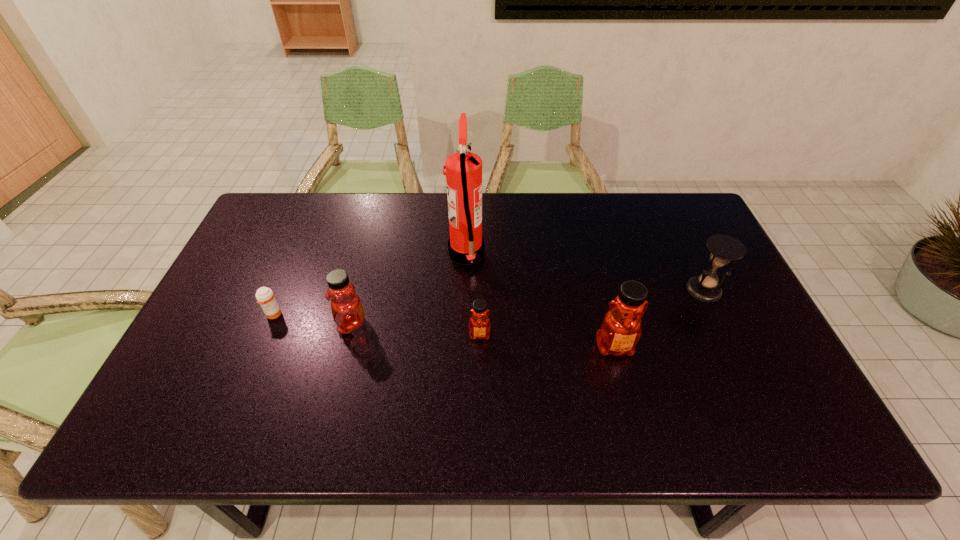
Locate an element on the screen. the second object from left to right is located at coordinates (346, 306).

The width and height of the screenshot is (960, 540). Find the location of `the leftmost honey`. the leftmost honey is located at coordinates (346, 306).

The width and height of the screenshot is (960, 540). In order to click on the second honey from right to left in this screenshot , I will do `click(479, 324)`.

This screenshot has height=540, width=960. Identify the location of the shortest honey. (479, 324).

Where is `the fifth object from left to right`? This screenshot has height=540, width=960. the fifth object from left to right is located at coordinates (621, 329).

This screenshot has height=540, width=960. What are the coordinates of `the tallest object` in the screenshot? It's located at (463, 173).

Where is `the rightmost object`? This screenshot has height=540, width=960. the rightmost object is located at coordinates (724, 248).

Where is `the shortest object`? This screenshot has height=540, width=960. the shortest object is located at coordinates (266, 299).

Find the location of a particular element. medicine is located at coordinates [x=266, y=299].

The height and width of the screenshot is (540, 960). I want to click on blank area located 0.130m on the front label of the second object from left to right, so click(x=287, y=323).